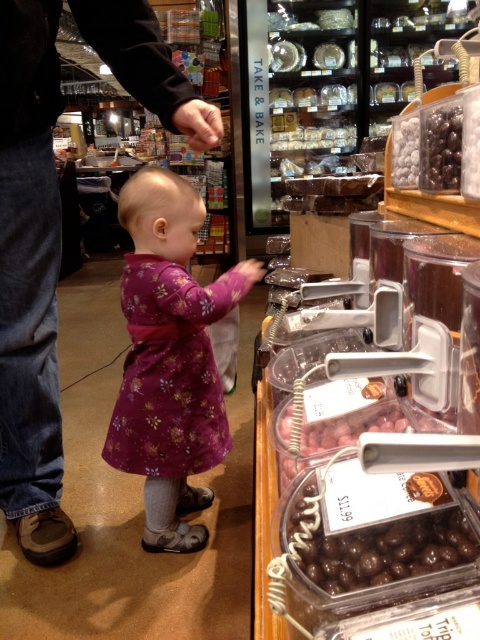
Where is the purple floral dress at center located in the image?

The purple floral dress at center is located at point (169, 358) in the image.

You are a customer at the bakery and want to pick up the shiny chocolate candy at upper right. However, there is a purple floral dress at center blocking your view. Can you reach the candy without moving the dress?

The purple floral dress at center is positioned under the shiny chocolate candy at upper right, meaning the candy is above the dress. Since the dress is blocking your view, you might still be able to reach the candy by extending your hand over the dress.